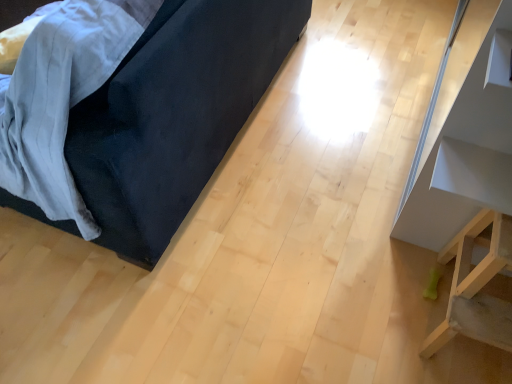
Locate an element on the screen. light wood stool at lower right, the second furniture viewed from the right is located at coordinates (476, 286).

Image resolution: width=512 pixels, height=384 pixels. Describe the element at coordinates (468, 177) in the screenshot. I see `white glossy shelf at upper right, positioned as the 1th furniture in right-to-left order` at that location.

Identify the location of velvet dark blue couch at left, placed as the 3th furniture when sorted from right to left. This screenshot has height=384, width=512. (174, 114).

Is velvet dark blue couch at left, the first furniture when ordered from left to right, at the back of light wood stool at lower right, the second furniture from the left?

light wood stool at lower right, the second furniture from the left, is not turned away from velvet dark blue couch at left, the first furniture when ordered from left to right.

Based on the photo, from a real-world perspective, which is physically above, light wood stool at lower right, the second furniture viewed from the right, or velvet dark blue couch at left, the first furniture when ordered from left to right?

In real-world perspective, velvet dark blue couch at left, the first furniture when ordered from left to right, is above.

Based on the photo, is velvet dark blue couch at left, the first furniture when ordered from left to right, inside light wood stool at lower right, the second furniture from the left?

Definitely not — velvet dark blue couch at left, the first furniture when ordered from left to right, is not inside light wood stool at lower right, the second furniture from the left.

Considering the sizes of objects light wood stool at lower right, the second furniture viewed from the right, and velvet dark blue couch at left, placed as the 3th furniture when sorted from right to left, in the image provided, who is wider, light wood stool at lower right, the second furniture viewed from the right, or velvet dark blue couch at left, placed as the 3th furniture when sorted from right to left,?

velvet dark blue couch at left, placed as the 3th furniture when sorted from right to left, is wider.

Does velvet dark blue couch at left, the first furniture when ordered from left to right, lie in front of light wood stool at lower right, the second furniture viewed from the right?

Yes, velvet dark blue couch at left, the first furniture when ordered from left to right, is in front of light wood stool at lower right, the second furniture viewed from the right.

Is point (191, 76) closer or farther from the camera than point (488, 255)?

Clearly, point (191, 76) is more distant from the camera than point (488, 255).

Choose the correct answer: Is velvet dark blue couch at left, the first furniture when ordered from left to right, inside light wood stool at lower right, the second furniture from the left, or outside it?

velvet dark blue couch at left, the first furniture when ordered from left to right, cannot be found inside light wood stool at lower right, the second furniture from the left.

Does light wood stool at lower right, the second furniture viewed from the right, have a greater width compared to white glossy shelf at upper right, positioned as the 1th furniture in right-to-left order?

Correct, the width of light wood stool at lower right, the second furniture viewed from the right, exceeds that of white glossy shelf at upper right, positioned as the 1th furniture in right-to-left order.

Is light wood stool at lower right, the second furniture viewed from the right, in front of or behind white glossy shelf at upper right, marked as the 3th furniture in a left-to-right arrangement, in the image?

light wood stool at lower right, the second furniture viewed from the right, is in front of white glossy shelf at upper right, marked as the 3th furniture in a left-to-right arrangement.

In the image, is light wood stool at lower right, the second furniture viewed from the right, on the left side or the right side of white glossy shelf at upper right, positioned as the 1th furniture in right-to-left order?

light wood stool at lower right, the second furniture viewed from the right, is to the left of white glossy shelf at upper right, positioned as the 1th furniture in right-to-left order.

Could you tell me if light wood stool at lower right, the second furniture from the left, is turned towards white glossy shelf at upper right, marked as the 3th furniture in a left-to-right arrangement?

No, light wood stool at lower right, the second furniture from the left, is not oriented towards white glossy shelf at upper right, marked as the 3th furniture in a left-to-right arrangement.

Can velvet dark blue couch at left, placed as the 3th furniture when sorted from right to left, be found inside white glossy shelf at upper right, marked as the 3th furniture in a left-to-right arrangement?

Actually, velvet dark blue couch at left, placed as the 3th furniture when sorted from right to left, is outside white glossy shelf at upper right, marked as the 3th furniture in a left-to-right arrangement.

From the picture: Does white glossy shelf at upper right, marked as the 3th furniture in a left-to-right arrangement, lie behind velvet dark blue couch at left, the first furniture when ordered from left to right?

Yes, white glossy shelf at upper right, marked as the 3th furniture in a left-to-right arrangement, is behind velvet dark blue couch at left, the first furniture when ordered from left to right.

Based on the photo, from a real-world perspective, which object rests below the other?

velvet dark blue couch at left, placed as the 3th furniture when sorted from right to left, from a real-world perspective.

From the image's perspective, which one is positioned lower, white glossy shelf at upper right, marked as the 3th furniture in a left-to-right arrangement, or velvet dark blue couch at left, the first furniture when ordered from left to right?

white glossy shelf at upper right, marked as the 3th furniture in a left-to-right arrangement, is shown below in the image.

From a real-world perspective, relative to light wood stool at lower right, the second furniture viewed from the right, is white glossy shelf at upper right, marked as the 3th furniture in a left-to-right arrangement, vertically above or below?

white glossy shelf at upper right, marked as the 3th furniture in a left-to-right arrangement, is above light wood stool at lower right, the second furniture viewed from the right.

Looking at this image, can you tell me how much white glossy shelf at upper right, marked as the 3th furniture in a left-to-right arrangement, and light wood stool at lower right, the second furniture viewed from the right, differ in facing direction?

white glossy shelf at upper right, marked as the 3th furniture in a left-to-right arrangement, and light wood stool at lower right, the second furniture viewed from the right, are facing 90.9 degrees away from each other.

Who is taller, white glossy shelf at upper right, marked as the 3th furniture in a left-to-right arrangement, or light wood stool at lower right, the second furniture from the left?

Standing taller between the two is white glossy shelf at upper right, marked as the 3th furniture in a left-to-right arrangement.

Is white glossy shelf at upper right, marked as the 3th furniture in a left-to-right arrangement, at the left side of light wood stool at lower right, the second furniture viewed from the right?

No, white glossy shelf at upper right, marked as the 3th furniture in a left-to-right arrangement, is not to the left of light wood stool at lower right, the second furniture viewed from the right.

Is velvet dark blue couch at left, placed as the 3th furniture when sorted from right to left, wider or thinner than white glossy shelf at upper right, marked as the 3th furniture in a left-to-right arrangement?

Considering their sizes, velvet dark blue couch at left, placed as the 3th furniture when sorted from right to left, looks broader than white glossy shelf at upper right, marked as the 3th furniture in a left-to-right arrangement.

Would you say velvet dark blue couch at left, the first furniture when ordered from left to right, is a long distance from white glossy shelf at upper right, positioned as the 1th furniture in right-to-left order?

No.

Considering the points (167, 129) and (453, 152), which point is behind, point (167, 129) or point (453, 152)?

Positioned behind is point (167, 129).

Does velvet dark blue couch at left, the first furniture when ordered from left to right, appear on the right side of white glossy shelf at upper right, positioned as the 1th furniture in right-to-left order?

Incorrect, velvet dark blue couch at left, the first furniture when ordered from left to right, is not on the right side of white glossy shelf at upper right, positioned as the 1th furniture in right-to-left order.

What are the coordinates of `furniture below the velvet dark blue couch at left, the first furniture when ordered from left to right (from a real-world perspective)` in the screenshot? It's located at (476, 286).

From a real-world perspective, which furniture is the 1st one above the light wood stool at lower right, the second furniture viewed from the right? Please provide its 2D coordinates.

[(174, 114)]

From the picture: From the image, which object appears to be nearer to white glossy shelf at upper right, marked as the 3th furniture in a left-to-right arrangement, light wood stool at lower right, the second furniture viewed from the right, or velvet dark blue couch at left, placed as the 3th furniture when sorted from right to left?

Among the two, light wood stool at lower right, the second furniture viewed from the right, is located nearer to white glossy shelf at upper right, marked as the 3th furniture in a left-to-right arrangement.

When comparing their distances from light wood stool at lower right, the second furniture from the left, does velvet dark blue couch at left, placed as the 3th furniture when sorted from right to left, or white glossy shelf at upper right, marked as the 3th furniture in a left-to-right arrangement, seem further?

velvet dark blue couch at left, placed as the 3th furniture when sorted from right to left.

When comparing their distances from light wood stool at lower right, the second furniture from the left, does white glossy shelf at upper right, positioned as the 1th furniture in right-to-left order, or velvet dark blue couch at left, placed as the 3th furniture when sorted from right to left, seem further?

The object further to light wood stool at lower right, the second furniture from the left, is velvet dark blue couch at left, placed as the 3th furniture when sorted from right to left.

Looking at the image, which one is located closer to velvet dark blue couch at left, the first furniture when ordered from left to right, white glossy shelf at upper right, positioned as the 1th furniture in right-to-left order, or light wood stool at lower right, the second furniture from the left?

Among the two, white glossy shelf at upper right, positioned as the 1th furniture in right-to-left order, is located nearer to velvet dark blue couch at left, the first furniture when ordered from left to right.

Estimate the real-world distances between objects in this image. Which object is further from velvet dark blue couch at left, the first furniture when ordered from left to right, light wood stool at lower right, the second furniture from the left, or white glossy shelf at upper right, marked as the 3th furniture in a left-to-right arrangement?

light wood stool at lower right, the second furniture from the left, lies further to velvet dark blue couch at left, the first furniture when ordered from left to right, than the other object.

Looking at the image, which one is located further to white glossy shelf at upper right, positioned as the 1th furniture in right-to-left order, velvet dark blue couch at left, the first furniture when ordered from left to right, or light wood stool at lower right, the second furniture from the left?

Based on the image, velvet dark blue couch at left, the first furniture when ordered from left to right, appears to be further to white glossy shelf at upper right, positioned as the 1th furniture in right-to-left order.

Identify the location of furniture between velvet dark blue couch at left, placed as the 3th furniture when sorted from right to left, and white glossy shelf at upper right, marked as the 3th furniture in a left-to-right arrangement, from left to right. (476, 286).